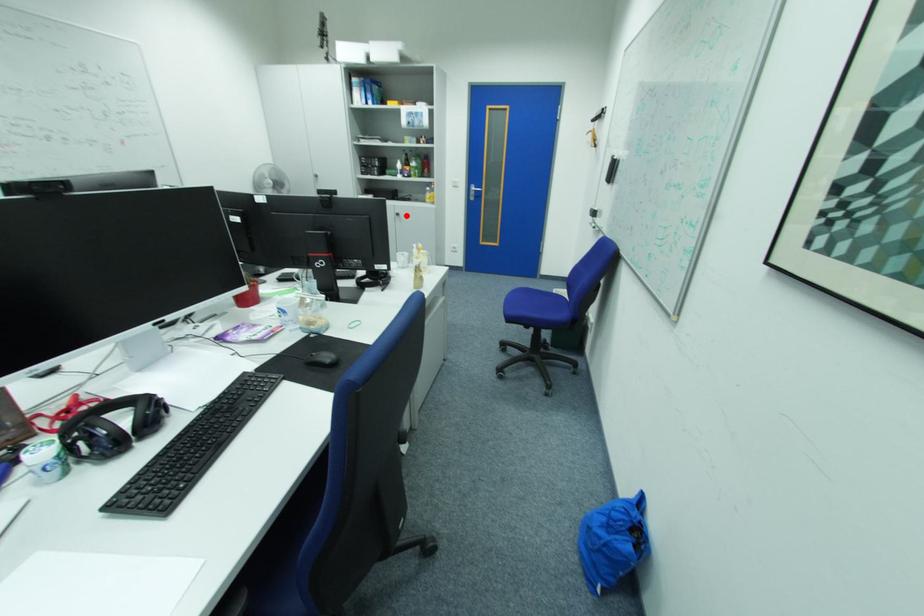
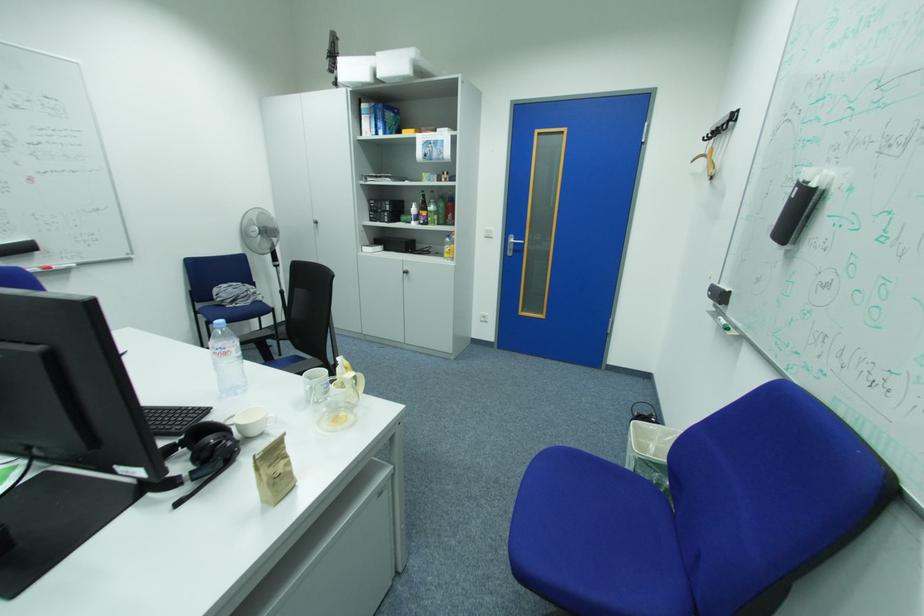
Locate, in the second image, the point that corresponds to the highlighted location in the first image.

(415, 273)